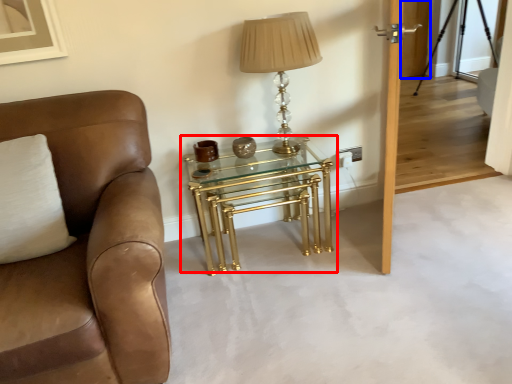
Question: Which point is closer to the camera, table (highlighted by a red box) or glass door (highlighted by a blue box)?

Choices:
 (A) table
 (B) glass door

Answer: (A)